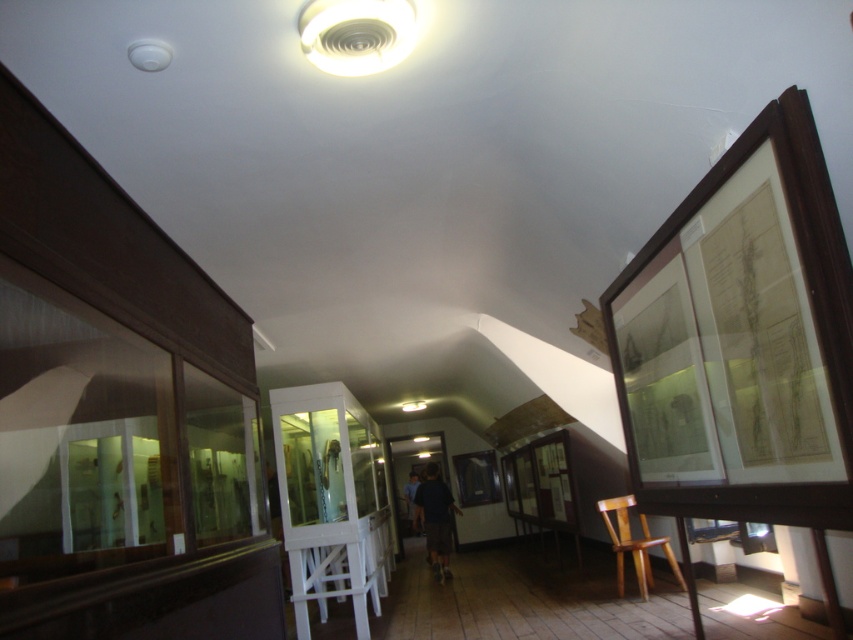
You are standing in the museum and looking up at the white plastic ceiling fan at upper center. If you want to reach it with a 2.5 meter ladder, will the ladder be long enough?

The distance between you and the white plastic ceiling fan at upper center is 2.04 meters. Since the ladder is 2.5 meters long, it is sufficient to reach the fan.

You are standing in the museum and want to sit down. There is a wooden chair at lower right. To your left, there is a white plastic ceiling fan at upper center. Which object is positioned to the left of the other?

The white plastic ceiling fan at upper center is to the left of the wooden chair at lower right.